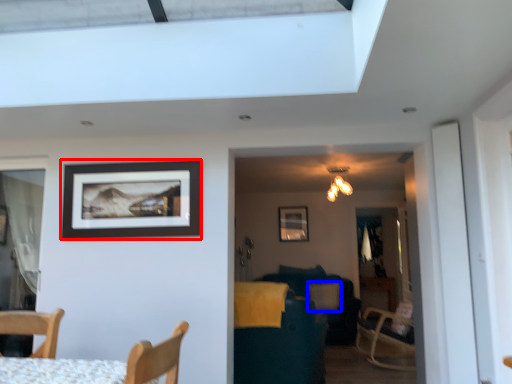
Question: Among these objects, which one is nearest to the camera, picture frame (highlighted by a red box) or pillow (highlighted by a blue box)?

Choices:
 (A) picture frame
 (B) pillow

Answer: (A)